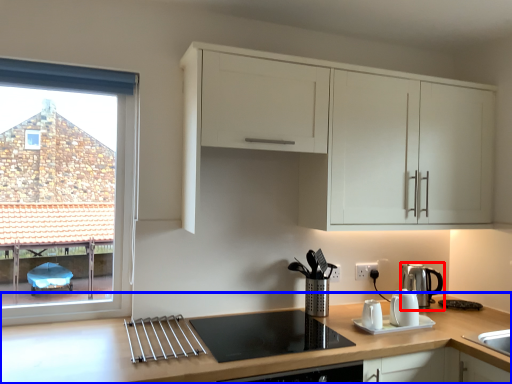
Question: Among these objects, which one is farthest to the camera, kitchen appliance (highlighted by a red box) or countertop (highlighted by a blue box)?

Choices:
 (A) kitchen appliance
 (B) countertop

Answer: (A)